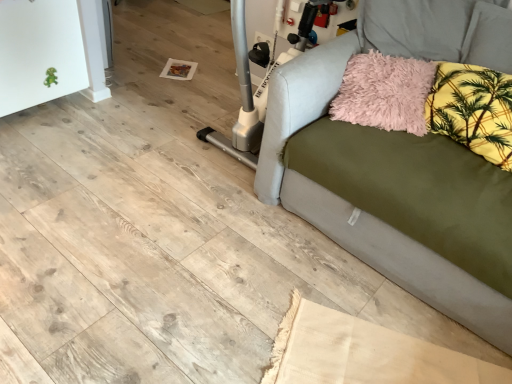
Question: From a real-world perspective, is fluffy pink pillow at upper right, which ranks as the first pillow in left-to-right order, above or below yellow floral fabric pillow at upper right, the 2th pillow from the left?

Choices:
 (A) below
 (B) above

Answer: (A)

Question: Is point (393, 102) positioned closer to the camera than point (488, 74)?

Choices:
 (A) closer
 (B) farther

Answer: (B)

Question: Which object is the farthest from the beige fabric rug at lower center?

Choices:
 (A) olive green fabric couch at right
 (B) fluffy pink pillow at upper right, which ranks as the first pillow in left-to-right order
 (C) yellow floral fabric pillow at upper right, acting as the 1th pillow starting from the right

Answer: (B)

Question: Which is nearer to the beige fabric rug at lower center?

Choices:
 (A) olive green fabric couch at right
 (B) yellow floral fabric pillow at upper right, acting as the 1th pillow starting from the right
 (C) fluffy pink pillow at upper right, placed as the second pillow when sorted from right to left

Answer: (A)